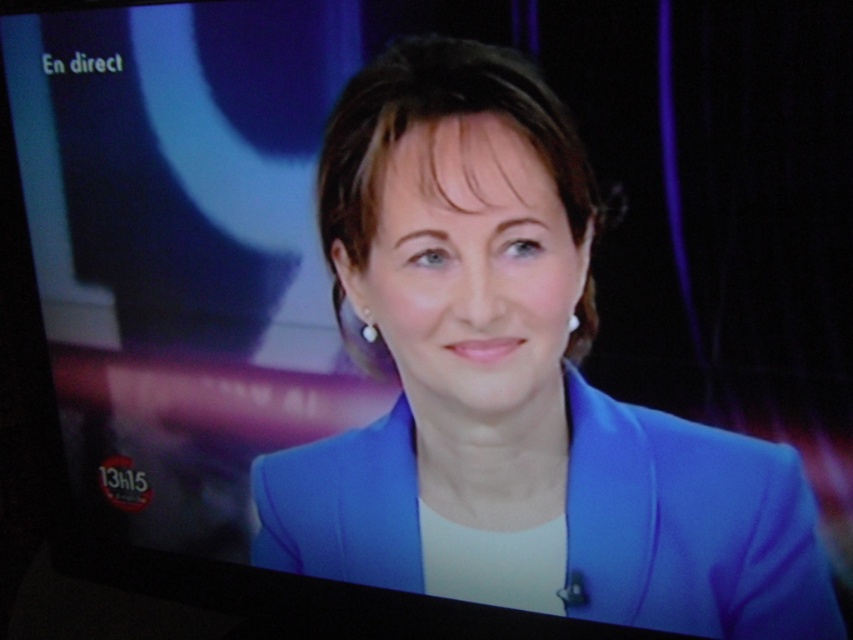
Question: Does blue fabric jacket at center lie in front of blue smooth blazer at center?

Choices:
 (A) yes
 (B) no

Answer: (A)

Question: Which point is closer to the camera?

Choices:
 (A) blue smooth blazer at center
 (B) blue fabric jacket at center

Answer: (B)

Question: Which point is closer to the camera?

Choices:
 (A) (375, 99)
 (B) (718, 486)

Answer: (B)

Question: Does blue fabric jacket at center appear over blue smooth blazer at center?

Choices:
 (A) yes
 (B) no

Answer: (A)

Question: Does blue fabric jacket at center appear on the left side of blue smooth blazer at center?

Choices:
 (A) no
 (B) yes

Answer: (B)

Question: Among these points, which one is farthest from the camera?

Choices:
 (A) (264, 563)
 (B) (579, 372)

Answer: (A)